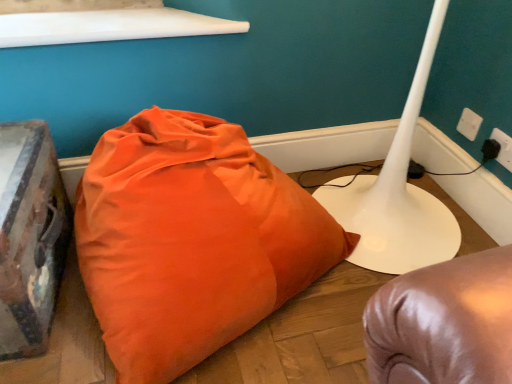
Question: Should I look upward or downward to see orange fabric pillow at center?

Choices:
 (A) down
 (B) up

Answer: (A)

Question: Is white glossy table lamp at lower right positioned far away from white plastic electric outlet at upper right, the 1th electric outlet when ordered from back to front?

Choices:
 (A) yes
 (B) no

Answer: (B)

Question: Is white glossy table lamp at lower right bigger than white plastic electric outlet at upper right, which is the 2th electric outlet from bottom to top?

Choices:
 (A) no
 (B) yes

Answer: (B)

Question: Can you confirm if white glossy table lamp at lower right is smaller than white plastic electric outlet at upper right, which is the 2th electric outlet in front-to-back order?

Choices:
 (A) yes
 (B) no

Answer: (B)

Question: Does white glossy table lamp at lower right have a lesser height compared to white plastic electric outlet at upper right, which is counted as the second electric outlet, starting from the right?

Choices:
 (A) no
 (B) yes

Answer: (A)

Question: From a real-world perspective, is white glossy table lamp at lower right below white plastic electric outlet at upper right, marked as the first electric outlet in a top-to-bottom arrangement?

Choices:
 (A) no
 (B) yes

Answer: (A)

Question: From the image's perspective, would you say white glossy table lamp at lower right is positioned over white plastic electric outlet at upper right, which is counted as the second electric outlet, starting from the right?

Choices:
 (A) yes
 (B) no

Answer: (B)

Question: Considering the relative sizes of orange fabric pillow at center and black plastic plug at lower right in the image provided, is orange fabric pillow at center taller than black plastic plug at lower right?

Choices:
 (A) no
 (B) yes

Answer: (B)

Question: From a real-world perspective, is orange fabric pillow at center physically above black plastic plug at lower right?

Choices:
 (A) no
 (B) yes

Answer: (A)

Question: Can you confirm if orange fabric pillow at center is smaller than black plastic plug at lower right?

Choices:
 (A) yes
 (B) no

Answer: (B)

Question: Is orange fabric pillow at center in contact with black plastic plug at lower right?

Choices:
 (A) no
 (B) yes

Answer: (A)

Question: Is orange fabric pillow at center wider than black plastic plug at lower right?

Choices:
 (A) yes
 (B) no

Answer: (A)

Question: From the image's perspective, does orange fabric pillow at center appear lower than black plastic plug at lower right?

Choices:
 (A) yes
 (B) no

Answer: (A)

Question: Is black plastic plug at lower right inside white plastic electric outlet at upper right, the 1th electric outlet when ordered from back to front?

Choices:
 (A) no
 (B) yes

Answer: (A)